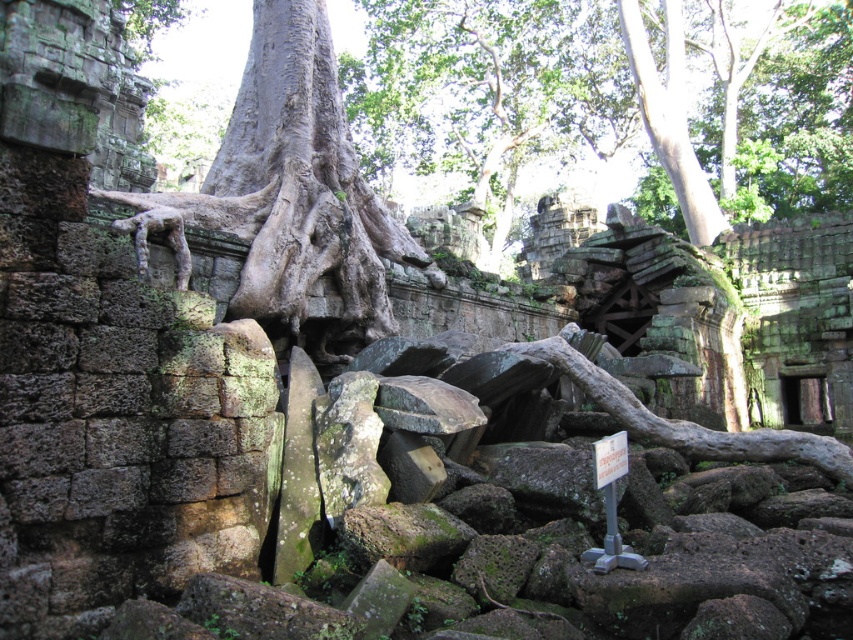
Is point (460, 157) positioned behind point (297, 234)?

Yes.

Does point (456, 13) come closer to viewer compared to point (300, 122)?

No, it is behind (300, 122).

Measure the distance between green mossy stone at upper center and camera.

The distance of green mossy stone at upper center from camera is 435.56 feet.

Find the location of a particular element. The image size is (853, 640). green mossy stone at upper center is located at coordinates (485, 83).

Who is higher up, green mossy wood at center or smooth gray bark at upper right?

smooth gray bark at upper right is above.

Identify the location of green mossy wood at center. This screenshot has height=640, width=853. (688, 420).

Locate an element on the screen. green mossy wood at center is located at coordinates (688, 420).

Measure the distance between green mossy stone at upper center and camera.

green mossy stone at upper center and camera are 435.56 feet apart.

Does green mossy stone at upper center lie in front of green mossy wood at center?

No, it is behind green mossy wood at center.

Does point (697, 124) come behind point (776, 449)?

That is True.

Where is `green mossy stone at upper center`? Image resolution: width=853 pixels, height=640 pixels. green mossy stone at upper center is located at coordinates (485, 83).